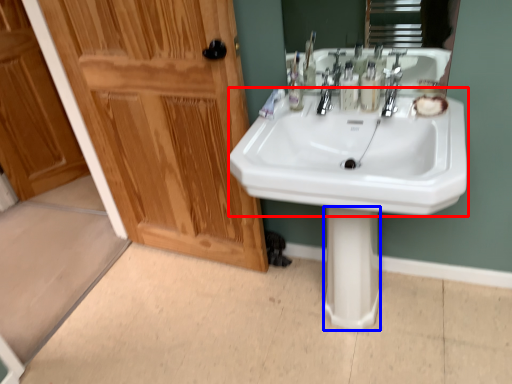
Question: Which of the following is the closest to the observer, sink (highlighted by a red box) or pillar (highlighted by a blue box)?

Choices:
 (A) sink
 (B) pillar

Answer: (A)